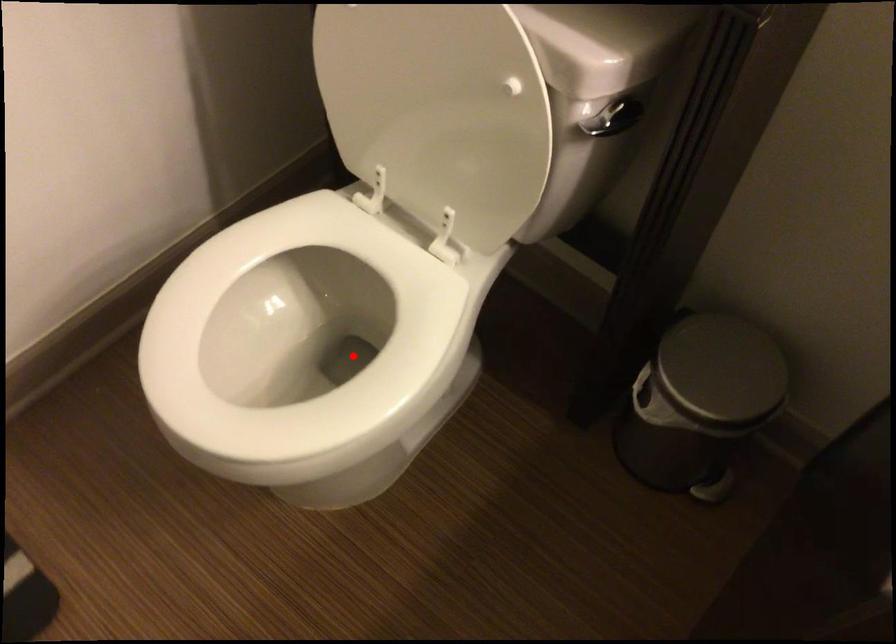
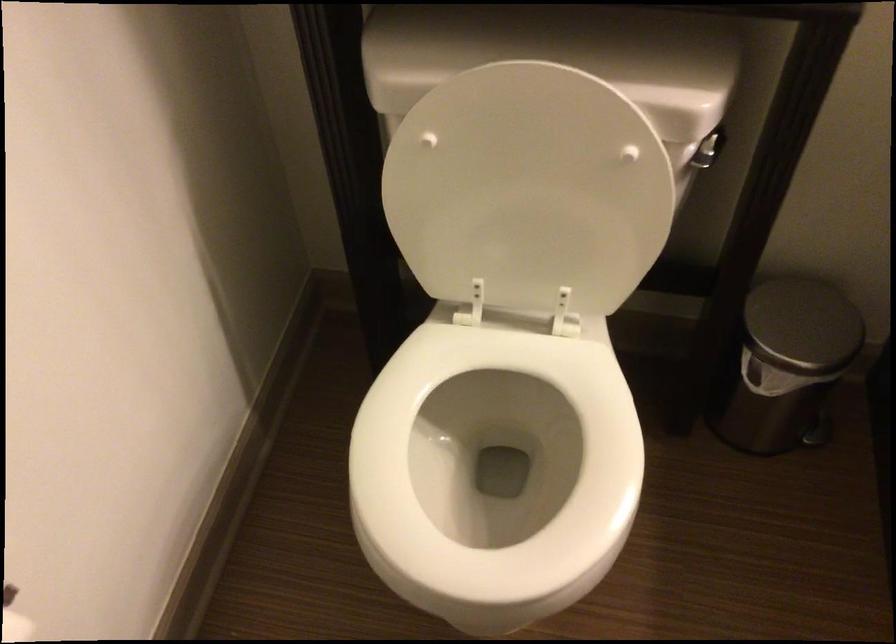
Find the pixel in the second image that matches the highlighted location in the first image.

(494, 468)